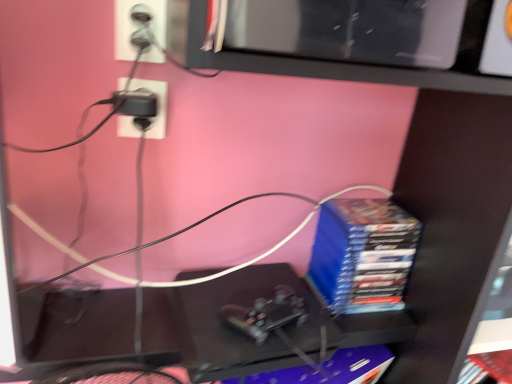
Find the location of a particular element. The image size is (512, 384). purple matte paperback book at center, which is the second paperback book from top to bottom is located at coordinates (330, 369).

In order to face purple matte paperback book at center, which is the second paperback book from top to bottom, should I rotate leftwards or rightwards?

Rotate your view right by about 8.438°.

The image size is (512, 384). Describe the element at coordinates (330, 369) in the screenshot. I see `purple matte paperback book at center, which is the second paperback book from top to bottom` at that location.

You are a GUI agent. You are given a task and a screenshot of the screen. Output one action in this format:
    pyautogui.click(x=<x>, y=<y>)
    Task: Click on the blue matte stack of books at right, which ranks as the 1th paperback book in top-to-bottom order
    The width and height of the screenshot is (512, 384).
    Given the screenshot: What is the action you would take?
    pyautogui.click(x=362, y=254)

What do you see at coordinates (362, 254) in the screenshot? Image resolution: width=512 pixels, height=384 pixels. I see `blue matte stack of books at right, the second paperback book positioned from the bottom` at bounding box center [362, 254].

Find the location of a particular element. purple matte paperback book at center, the 1th paperback book when ordered from bottom to top is located at coordinates (330, 369).

Which is more to the right, purple matte paperback book at center, the 1th paperback book when ordered from bottom to top, or blue matte stack of books at right, which ranks as the 1th paperback book in top-to-bottom order?

Positioned to the right is blue matte stack of books at right, which ranks as the 1th paperback book in top-to-bottom order.

Considering the positions of objects purple matte paperback book at center, the 1th paperback book when ordered from bottom to top, and blue matte stack of books at right, which ranks as the 1th paperback book in top-to-bottom order, in the image provided, who is behind, purple matte paperback book at center, the 1th paperback book when ordered from bottom to top, or blue matte stack of books at right, which ranks as the 1th paperback book in top-to-bottom order,?

blue matte stack of books at right, which ranks as the 1th paperback book in top-to-bottom order, is further away from the camera.

Is point (347, 368) closer to viewer compared to point (323, 243)?

Yes, it is.

From the image's perspective, which is below, purple matte paperback book at center, which is the second paperback book from top to bottom, or blue matte stack of books at right, which ranks as the 1th paperback book in top-to-bottom order?

purple matte paperback book at center, which is the second paperback book from top to bottom.

From a real-world perspective, is purple matte paperback book at center, which is the second paperback book from top to bottom, above or below blue matte stack of books at right, the second paperback book positioned from the bottom?

Clearly, from a real-world perspective, purple matte paperback book at center, which is the second paperback book from top to bottom, is below blue matte stack of books at right, the second paperback book positioned from the bottom.

Considering the relative sizes of purple matte paperback book at center, the 1th paperback book when ordered from bottom to top, and blue matte stack of books at right, the second paperback book positioned from the bottom, in the image provided, is purple matte paperback book at center, the 1th paperback book when ordered from bottom to top, wider than blue matte stack of books at right, the second paperback book positioned from the bottom,?

In fact, purple matte paperback book at center, the 1th paperback book when ordered from bottom to top, might be narrower than blue matte stack of books at right, the second paperback book positioned from the bottom.

Considering the sizes of objects purple matte paperback book at center, which is the second paperback book from top to bottom, and blue matte stack of books at right, the second paperback book positioned from the bottom, in the image provided, who is taller, purple matte paperback book at center, which is the second paperback book from top to bottom, or blue matte stack of books at right, the second paperback book positioned from the bottom,?

With more height is blue matte stack of books at right, the second paperback book positioned from the bottom.

Is purple matte paperback book at center, which is the second paperback book from top to bottom, bigger or smaller than blue matte stack of books at right, the second paperback book positioned from the bottom?

Considering their sizes, purple matte paperback book at center, which is the second paperback book from top to bottom, takes up less space than blue matte stack of books at right, the second paperback book positioned from the bottom.

Is purple matte paperback book at center, the 1th paperback book when ordered from bottom to top, positioned beyond the bounds of blue matte stack of books at right, the second paperback book positioned from the bottom?

Yes.

Is purple matte paperback book at center, the 1th paperback book when ordered from bottom to top, not near blue matte stack of books at right, the second paperback book positioned from the bottom?

That's not correct — purple matte paperback book at center, the 1th paperback book when ordered from bottom to top, is a little close to blue matte stack of books at right, the second paperback book positioned from the bottom.

Is blue matte stack of books at right, the second paperback book positioned from the bottom, at the back of purple matte paperback book at center, which is the second paperback book from top to bottom?

That's not correct — purple matte paperback book at center, which is the second paperback book from top to bottom, is not looking away from blue matte stack of books at right, the second paperback book positioned from the bottom.

From the picture: Can you tell me how much purple matte paperback book at center, which is the second paperback book from top to bottom, and blue matte stack of books at right, the second paperback book positioned from the bottom, differ in facing direction?

purple matte paperback book at center, which is the second paperback book from top to bottom, and blue matte stack of books at right, the second paperback book positioned from the bottom, are facing 18.2 degrees away from each other.

This screenshot has width=512, height=384. In order to click on paperback book on the left of blue matte stack of books at right, which ranks as the 1th paperback book in top-to-bottom order in this screenshot , I will do (330, 369).

In the scene shown: Based on their positions, is blue matte stack of books at right, which ranks as the 1th paperback book in top-to-bottom order, located to the left or right of purple matte paperback book at center, which is the second paperback book from top to bottom?

blue matte stack of books at right, which ranks as the 1th paperback book in top-to-bottom order, is positioned on purple matte paperback book at center, which is the second paperback book from top to bottom,'s right side.

Which object is more forward, blue matte stack of books at right, which ranks as the 1th paperback book in top-to-bottom order, or purple matte paperback book at center, the 1th paperback book when ordered from bottom to top?

purple matte paperback book at center, the 1th paperback book when ordered from bottom to top, is closer to the camera.

Does point (358, 291) appear closer or farther from the camera than point (380, 350)?

Point (358, 291) is positioned closer to the camera compared to point (380, 350).

From the image's perspective, which is above, blue matte stack of books at right, which ranks as the 1th paperback book in top-to-bottom order, or purple matte paperback book at center, the 1th paperback book when ordered from bottom to top?

blue matte stack of books at right, which ranks as the 1th paperback book in top-to-bottom order, is shown above in the image.

From a real-world perspective, who is located higher, blue matte stack of books at right, which ranks as the 1th paperback book in top-to-bottom order, or purple matte paperback book at center, the 1th paperback book when ordered from bottom to top?

blue matte stack of books at right, which ranks as the 1th paperback book in top-to-bottom order, from a real-world perspective.

Considering the relative sizes of blue matte stack of books at right, which ranks as the 1th paperback book in top-to-bottom order, and purple matte paperback book at center, the 1th paperback book when ordered from bottom to top, in the image provided, is blue matte stack of books at right, which ranks as the 1th paperback book in top-to-bottom order, thinner than purple matte paperback book at center, the 1th paperback book when ordered from bottom to top,?

No, blue matte stack of books at right, which ranks as the 1th paperback book in top-to-bottom order, is not thinner than purple matte paperback book at center, the 1th paperback book when ordered from bottom to top.

Between blue matte stack of books at right, the second paperback book positioned from the bottom, and purple matte paperback book at center, the 1th paperback book when ordered from bottom to top, which one has more height?

blue matte stack of books at right, the second paperback book positioned from the bottom, is taller.

Considering the relative sizes of blue matte stack of books at right, which ranks as the 1th paperback book in top-to-bottom order, and purple matte paperback book at center, which is the second paperback book from top to bottom, in the image provided, is blue matte stack of books at right, which ranks as the 1th paperback book in top-to-bottom order, smaller than purple matte paperback book at center, which is the second paperback book from top to bottom,?

No.

Could purple matte paperback book at center, which is the second paperback book from top to bottom, be considered to be inside blue matte stack of books at right, the second paperback book positioned from the bottom?

No, purple matte paperback book at center, which is the second paperback book from top to bottom, is located outside of blue matte stack of books at right, the second paperback book positioned from the bottom.

Is blue matte stack of books at right, the second paperback book positioned from the bottom, next to purple matte paperback book at center, which is the second paperback book from top to bottom, and touching it?

No, blue matte stack of books at right, the second paperback book positioned from the bottom, is not beside purple matte paperback book at center, which is the second paperback book from top to bottom.

Is blue matte stack of books at right, the second paperback book positioned from the bottom, positioned with its back to purple matte paperback book at center, the 1th paperback book when ordered from bottom to top?

blue matte stack of books at right, the second paperback book positioned from the bottom, is not turned away from purple matte paperback book at center, the 1th paperback book when ordered from bottom to top.

Can you tell me how much blue matte stack of books at right, the second paperback book positioned from the bottom, and purple matte paperback book at center, the 1th paperback book when ordered from bottom to top, differ in facing direction?

The angle between the facing direction of blue matte stack of books at right, the second paperback book positioned from the bottom, and the facing direction of purple matte paperback book at center, the 1th paperback book when ordered from bottom to top, is 18.2 degrees.

How much distance is there between blue matte stack of books at right, which ranks as the 1th paperback book in top-to-bottom order, and purple matte paperback book at center, which is the second paperback book from top to bottom?

blue matte stack of books at right, which ranks as the 1th paperback book in top-to-bottom order, and purple matte paperback book at center, which is the second paperback book from top to bottom, are 20.12 centimeters apart.

Locate an element on the screen. The height and width of the screenshot is (384, 512). paperback book lying on the right of purple matte paperback book at center, which is the second paperback book from top to bottom is located at coordinates (362, 254).

This screenshot has width=512, height=384. What are the coordinates of `paperback book above the purple matte paperback book at center, which is the second paperback book from top to bottom (from the image's perspective)` in the screenshot? It's located at (362, 254).

Locate an element on the screen. Image resolution: width=512 pixels, height=384 pixels. paperback book that appears on the left of blue matte stack of books at right, the second paperback book positioned from the bottom is located at coordinates (330, 369).